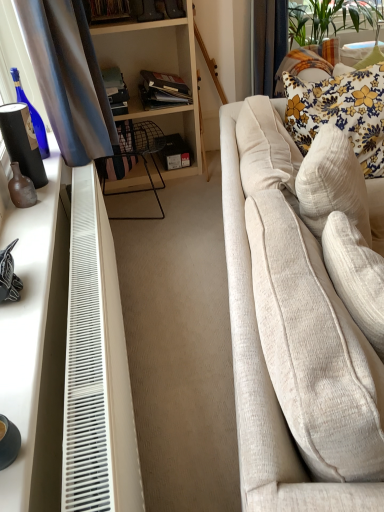
This screenshot has height=512, width=384. I want to click on white plastic radiator at lower left, so tap(87, 362).

Locate an element on the screen. The image size is (384, 512). floral fabric pillow at upper right is located at coordinates (341, 112).

What do you see at coordinates (36, 343) in the screenshot? I see `white matte desk at left` at bounding box center [36, 343].

The width and height of the screenshot is (384, 512). In order to click on black matte box at center in this screenshot , I will do `click(174, 153)`.

What is the approximate height of matte black vase at left?

matte black vase at left is 11.91 inches tall.

What is the approximate width of brown matte vase at left?

The width of brown matte vase at left is 2.79 inches.

Identify the location of brown matte vase at left. The image size is (384, 512). (21, 188).

In order to click on white plastic radiator at lower left in this screenshot , I will do `click(87, 362)`.

Considering the relative sizes of white plastic radiator at lower left and matte black vase at left in the image provided, is white plastic radiator at lower left thinner than matte black vase at left?

Indeed, white plastic radiator at lower left has a lesser width compared to matte black vase at left.

Between white plastic radiator at lower left and matte black vase at left, which one has more height?

white plastic radiator at lower left is taller.

You are a GUI agent. You are given a task and a screenshot of the screen. Output one action in this format:
    pyautogui.click(x=<x>, y=<y>)
    Task: Click on the vase behind the white plastic radiator at lower left
    Image resolution: width=384 pixels, height=512 pixels.
    Given the screenshot: What is the action you would take?
    pyautogui.click(x=22, y=142)

Is black matte box at center inside floral fabric pillow at upper right?

No, black matte box at center is not a part of floral fabric pillow at upper right.

What's the angular difference between floral fabric pillow at upper right and black matte box at center's facing directions?

There is a 18.3-degree angle between the facing directions of floral fabric pillow at upper right and black matte box at center.

From a real-world perspective, is floral fabric pillow at upper right physically below black matte box at center?

Actually, floral fabric pillow at upper right is physically above black matte box at center in the real world.

Considering the positions of points (360, 87) and (168, 159), is point (360, 87) farther from camera compared to point (168, 159)?

No, (360, 87) is closer to viewer.

From a real-world perspective, is beige fabric couch at right below floral fabric pillow at upper right?

Yes, from a real-world perspective, beige fabric couch at right is under floral fabric pillow at upper right.

Measure the distance from beige fabric couch at right to floral fabric pillow at upper right.

They are 30.65 inches apart.

In terms of height, does beige fabric couch at right look taller or shorter compared to floral fabric pillow at upper right?

In the image, beige fabric couch at right appears to be taller than floral fabric pillow at upper right.

Image resolution: width=384 pixels, height=512 pixels. Find the location of `studio couch that is on the left side of floral fabric pillow at upper right`. studio couch that is on the left side of floral fabric pillow at upper right is located at coordinates (265, 378).

In the image, is black matte box at center positioned in front of or behind floral fabric pillow at upper right?

In the image, black matte box at center appears behind floral fabric pillow at upper right.

Which object is positioned more to the right, black matte box at center or floral fabric pillow at upper right?

Positioned to the right is floral fabric pillow at upper right.

Is black matte box at center smaller than floral fabric pillow at upper right?

Yes, black matte box at center is smaller than floral fabric pillow at upper right.

Who is shorter, black matte box at center or floral fabric pillow at upper right?

Standing shorter between the two is black matte box at center.

Choose the correct answer: Is floral fabric pillow at upper right inside beige fabric couch at right or outside it?

floral fabric pillow at upper right is enclosed within beige fabric couch at right.

Can you confirm if floral fabric pillow at upper right is smaller than beige fabric couch at right?

Correct, floral fabric pillow at upper right occupies less space than beige fabric couch at right.

From a real-world perspective, is floral fabric pillow at upper right beneath beige fabric couch at right?

Incorrect, from a real-world perspective, floral fabric pillow at upper right is higher than beige fabric couch at right.

How distant is floral fabric pillow at upper right from beige fabric couch at right?

floral fabric pillow at upper right is 30.65 inches away from beige fabric couch at right.

Can you tell me how much white matte desk at left and black matte box at center differ in facing direction?

They differ by 87.7 degrees in their facing directions.

Can you confirm if white matte desk at left is taller than black matte box at center?

In fact, white matte desk at left may be shorter than black matte box at center.

From the picture: Is white matte desk at left inside or outside of black matte box at center?

white matte desk at left is spatially situated outside black matte box at center.

Considering the relative sizes of white plastic radiator at lower left and beige fabric couch at right in the image provided, is white plastic radiator at lower left thinner than beige fabric couch at right?

Indeed, white plastic radiator at lower left has a lesser width compared to beige fabric couch at right.

From the picture: Which of these two, white plastic radiator at lower left or beige fabric couch at right, stands shorter?

Standing shorter between the two is white plastic radiator at lower left.

Based on their sizes in the image, would you say white plastic radiator at lower left is bigger or smaller than beige fabric couch at right?

In the image, white plastic radiator at lower left appears to be smaller than beige fabric couch at right.

Is white plastic radiator at lower left in front of or behind beige fabric couch at right in the image?

In the image, white plastic radiator at lower left appears behind beige fabric couch at right.

Where is `radiator in front of the matte black vase at left`? The width and height of the screenshot is (384, 512). radiator in front of the matte black vase at left is located at coordinates (87, 362).

Find the location of `box lying on the left of floral fabric pillow at upper right`. box lying on the left of floral fabric pillow at upper right is located at coordinates (174, 153).

When comparing their distances from brown matte vase at left, does white matte desk at left or black matte box at center seem closer?

white matte desk at left.

Considering their positions, is brown matte vase at left positioned closer to white matte desk at left than black matte box at center?

brown matte vase at left is closer to white matte desk at left.

Based on their spatial positions, is brown matte vase at left or floral fabric pillow at upper right closer to floral fabric pillow at upper right?

floral fabric pillow at upper right.

When comparing their distances from white matte desk at left, does beige fabric couch at right or white plastic radiator at lower left seem closer?

white plastic radiator at lower left lies closer to white matte desk at left than the other object.

When comparing their distances from beige fabric couch at right, does white matte desk at left or brown matte vase at left seem closer?

white matte desk at left lies closer to beige fabric couch at right than the other object.

When comparing their distances from matte black vase at left, does beige fabric couch at right or brown matte vase at left seem closer?

brown matte vase at left lies closer to matte black vase at left than the other object.

Based on their spatial positions, is beige fabric couch at right or matte black vase at left closer to white plastic radiator at lower left?

matte black vase at left.

Which object lies nearer to the anchor point floral fabric pillow at upper right, beige fabric couch at right or brown matte vase at left?

beige fabric couch at right lies closer to floral fabric pillow at upper right than the other object.

This screenshot has height=512, width=384. What are the coordinates of `bottle located between white plastic radiator at lower left and matte black vase at left in the depth direction` in the screenshot? It's located at (21, 188).

I want to click on pillow between white plastic radiator at lower left and floral fabric pillow at upper right in the front-back direction, so click(x=341, y=112).

Where is `vase located between beige fabric couch at right and black matte box at center in the depth direction`? vase located between beige fabric couch at right and black matte box at center in the depth direction is located at coordinates (22, 142).

Find the location of a particular element. Image resolution: width=384 pixels, height=512 pixels. curtain positioned between beige fabric couch at right and black matte box at center from near to far is located at coordinates (268, 42).